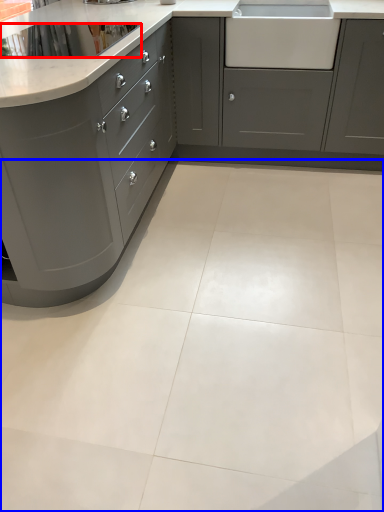
Question: Among these objects, which one is nearest to the camera, appliance (highlighted by a red box) or ceramic tile (highlighted by a blue box)?

Choices:
 (A) appliance
 (B) ceramic tile

Answer: (B)